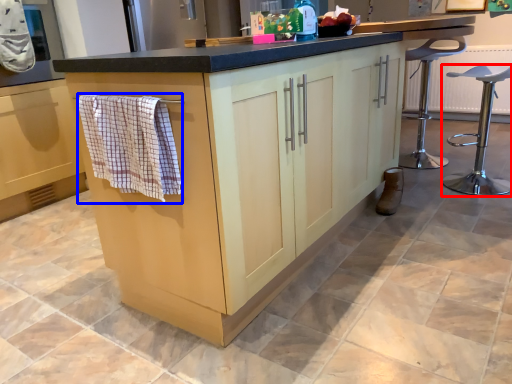
Question: Which point is closer to the camera, furniture (highlighted by a red box) or bath towel (highlighted by a blue box)?

Choices:
 (A) furniture
 (B) bath towel

Answer: (B)